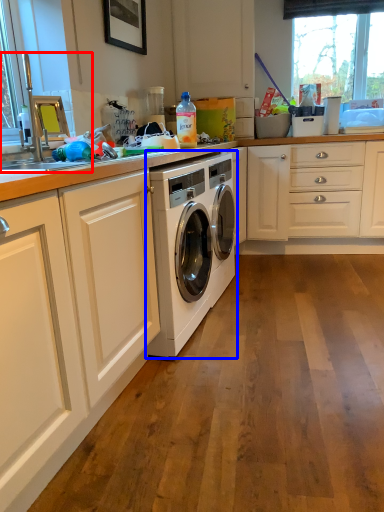
Question: Which of the following is the farthest to the observer, sink (highlighted by a red box) or washing machine (highlighted by a blue box)?

Choices:
 (A) sink
 (B) washing machine

Answer: (B)